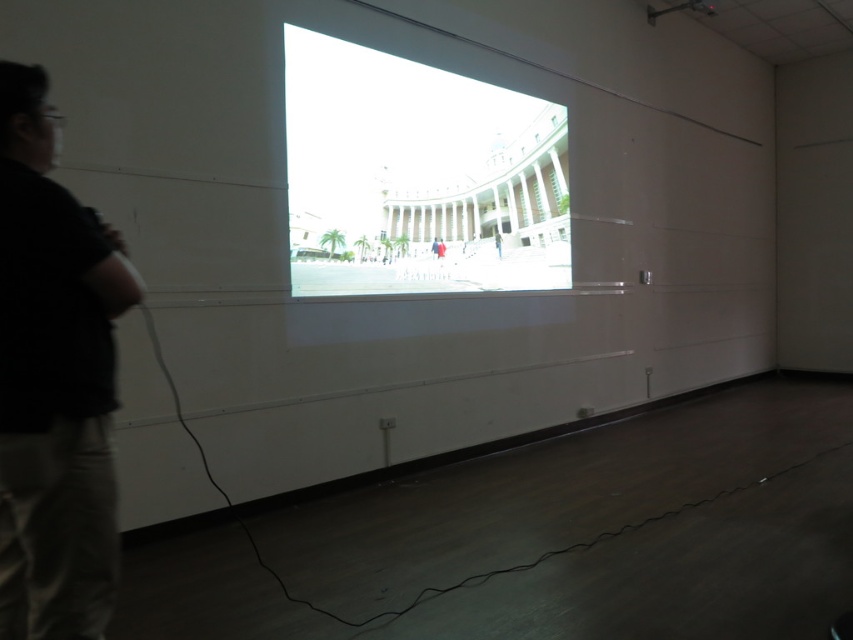
Question: Which point is farther from the camera taking this photo?

Choices:
 (A) (563, 259)
 (B) (28, 442)

Answer: (A)

Question: Can you confirm if bright white projection screen at center is positioned to the left of black cotton shirt at left?

Choices:
 (A) yes
 (B) no

Answer: (B)

Question: Is bright white projection screen at center below black cotton shirt at left?

Choices:
 (A) yes
 (B) no

Answer: (B)

Question: Is bright white projection screen at center thinner than black cotton shirt at left?

Choices:
 (A) yes
 (B) no

Answer: (B)

Question: Among these objects, which one is nearest to the camera?

Choices:
 (A) bright white projection screen at center
 (B) black cotton shirt at left

Answer: (B)

Question: Which of the following is the closest to the observer?

Choices:
 (A) black cotton shirt at left
 (B) bright white projection screen at center

Answer: (A)